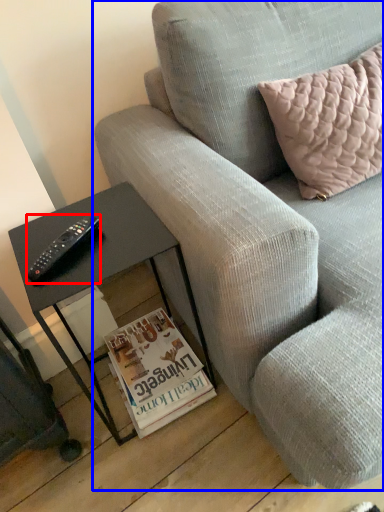
Question: Which object is closer to the camera taking this photo, remote (highlighted by a red box) or studio couch (highlighted by a blue box)?

Choices:
 (A) remote
 (B) studio couch

Answer: (B)